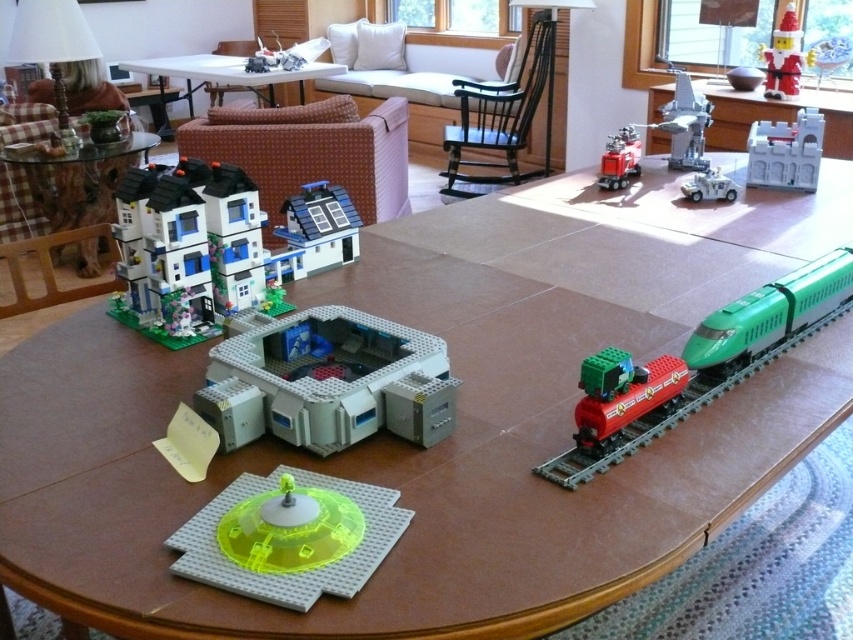
Question: Does translucent plastic building at center appear on the left side of white matte military vehicle at upper right?

Choices:
 (A) yes
 (B) no

Answer: (A)

Question: Is green plastic train at lower right further to camera compared to white plastic castle at upper right?

Choices:
 (A) no
 (B) yes

Answer: (A)

Question: Which point is closer to the camera?

Choices:
 (A) shiny red plastic truck at center
 (B) matte plastic house at upper left

Answer: (B)

Question: Which object is closer to the camera taking this photo?

Choices:
 (A) green plastic train at right
 (B) transparent glass table at upper left

Answer: (A)

Question: Is white plastic house at center smaller than white plastic castle at upper right?

Choices:
 (A) yes
 (B) no

Answer: (A)

Question: Which point appears farthest from the camera in this image?

Choices:
 (A) (318, 269)
 (B) (71, 154)

Answer: (B)